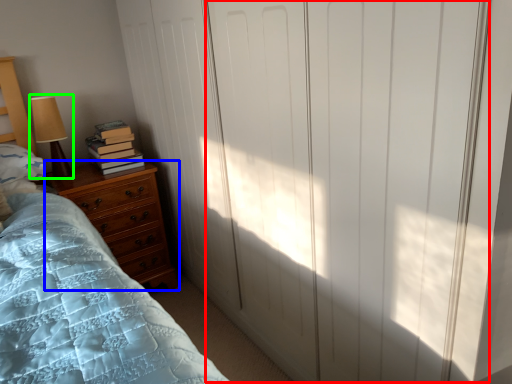
Question: Which object is positioned closest to screen door (highlighted by a red box)? Select from chest of drawers (highlighted by a blue box) and table lamp (highlighted by a green box).

Choices:
 (A) chest of drawers
 (B) table lamp

Answer: (A)